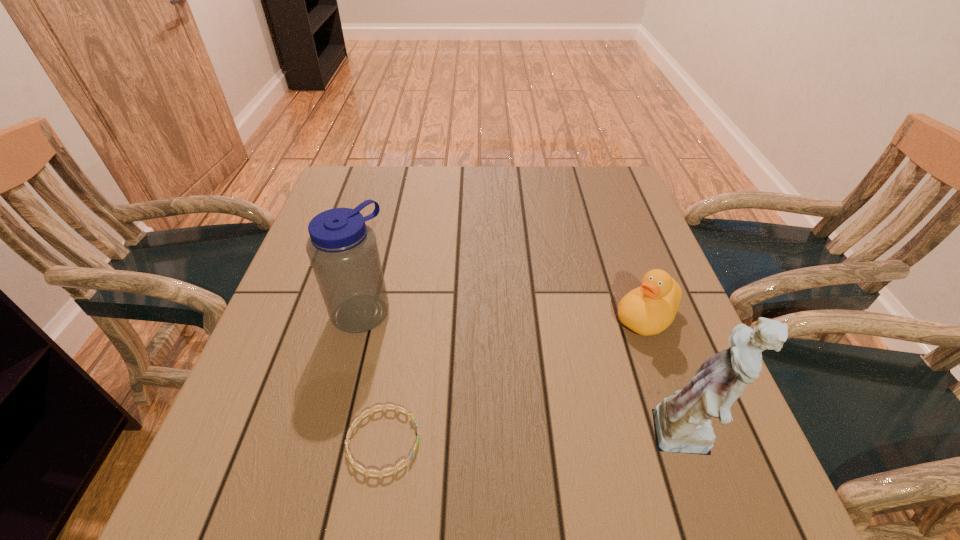
Identify the location of vacant space located on the face of the duck. The image size is (960, 540). (506, 448).

This screenshot has width=960, height=540. I want to click on bracelet at the near edge, so click(x=379, y=473).

The height and width of the screenshot is (540, 960). I want to click on figurine present at the near edge, so click(x=682, y=424).

Locate an element on the screen. object situated at the left edge is located at coordinates (342, 249).

Find the location of `figurine that is at the right edge`. figurine that is at the right edge is located at coordinates (682, 424).

Locate an element on the screen. Image resolution: width=960 pixels, height=540 pixels. duck present at the right edge is located at coordinates (647, 310).

This screenshot has height=540, width=960. Identify the location of object present at the near right corner. (682, 424).

In the image, there is a desktop. At what (x,y) coordinates should I click in order to perform the action: click on vacant space at the far edge. Please return your answer as a coordinate pair (x, y). The width and height of the screenshot is (960, 540). Looking at the image, I should click on (407, 167).

Locate an element on the screen. vacant region at the left edge of the desktop is located at coordinates point(321,353).

Where is `vacant space at the right edge of the desktop`? Image resolution: width=960 pixels, height=540 pixels. vacant space at the right edge of the desktop is located at coordinates (616, 213).